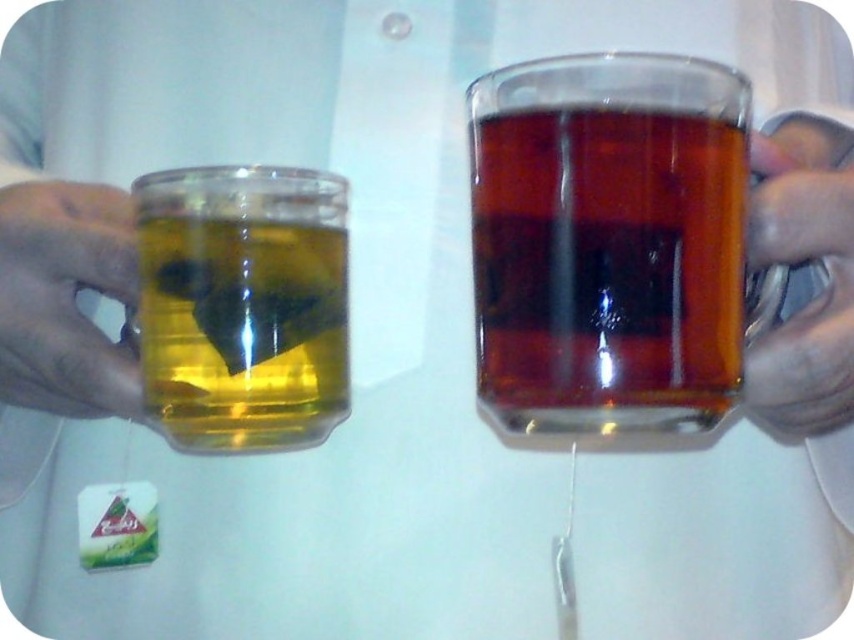
Question: Considering the relative positions of translucent glass tea bag at left and matte silver pen at right in the image provided, where is translucent glass tea bag at left located with respect to matte silver pen at right?

Choices:
 (A) below
 (B) above

Answer: (A)

Question: Observing the image, what is the correct spatial positioning of translucent glass mug at right in reference to matte plastic cup at left?

Choices:
 (A) above
 (B) below

Answer: (A)

Question: Is translucent glass mug at right thinner than matte plastic cup at left?

Choices:
 (A) no
 (B) yes

Answer: (A)

Question: Which object is the farthest from the translucent glass tea bag at left?

Choices:
 (A) translucent glass mug at right
 (B) matte plastic cup at left
 (C) matte silver pen at right

Answer: (C)

Question: Estimate the real-world distances between objects in this image. Which object is farther from the translucent glass mug at right?

Choices:
 (A) matte silver pen at right
 (B) matte plastic cup at left
 (C) translucent glass tea bag at left

Answer: (B)

Question: Which is farther from the translucent glass mug at right?

Choices:
 (A) matte silver pen at right
 (B) translucent glass tea bag at left

Answer: (B)